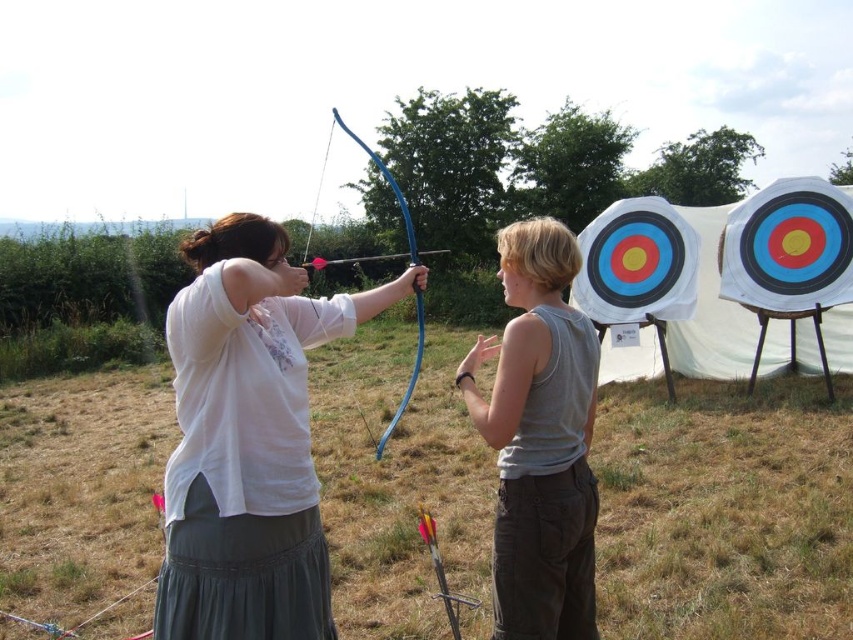
You are an archer preparing to shoot an arrow. You notice the blue wood bow at center and the yellow arrow at center. Which object is taller?

The blue wood bow at center is taller than the yellow arrow at center.

You are an archer standing at the shooting line. You notice the white matte shirt at center and the yellow arrow at center. How far apart are these two items?

The white matte shirt at center is 37.11 inches away from the yellow arrow at center.

You are an archer preparing to shoot an arrow. You notice the blue wood bow at center and the yellow arrow at center. Which object is located above the other?

The blue wood bow at center is positioned over yellow arrow at center, so the blue wood bow at center is above the yellow arrow at center.